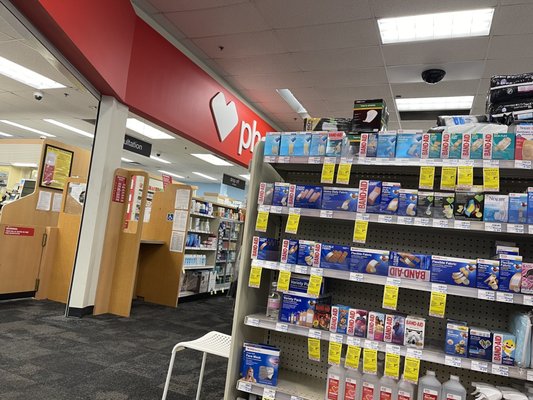
Where is `security camera`? The image size is (533, 400). security camera is located at coordinates (40, 102), (434, 75).